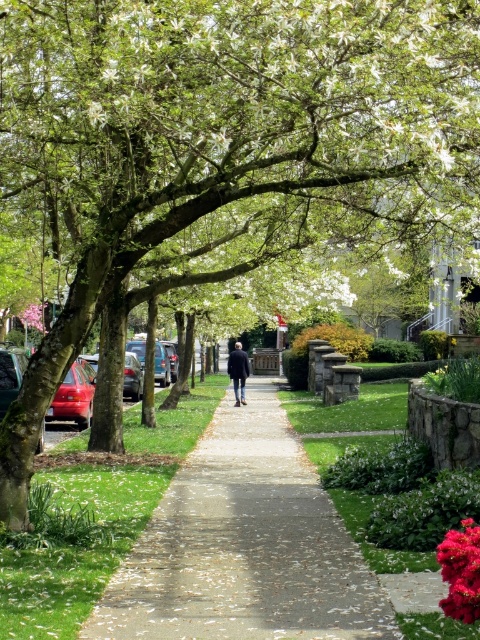
You are standing on the sidewalk in the suburban street scene. You notice two points marked in the image. Which point is closer to you, point (243, 538) or point (458, 547)?

Point (243, 538) is closer to you because it is further to the viewer than point (458, 547).

You are a delivery person carrying a package and need to walk along the concrete sidewalk at center. The shiny red car at left is parked nearby. Can you estimate whether the sidewalk is long enough to pass by the car without stepping onto the grass?

The concrete sidewalk at center is shorter than the shiny red car at left, so it might not be long enough to pass by the car without stepping onto the grass.